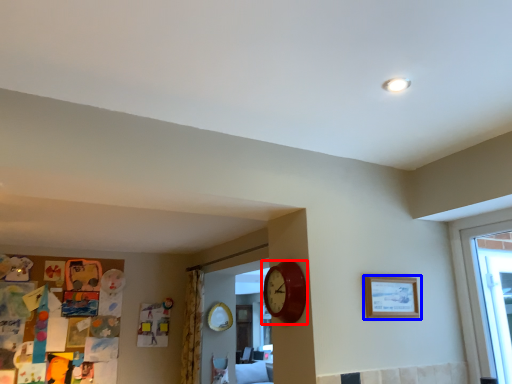
Question: Which object appears closest to the camera in this image, wall clock (highlighted by a red box) or picture frame (highlighted by a blue box)?

Choices:
 (A) wall clock
 (B) picture frame

Answer: (A)